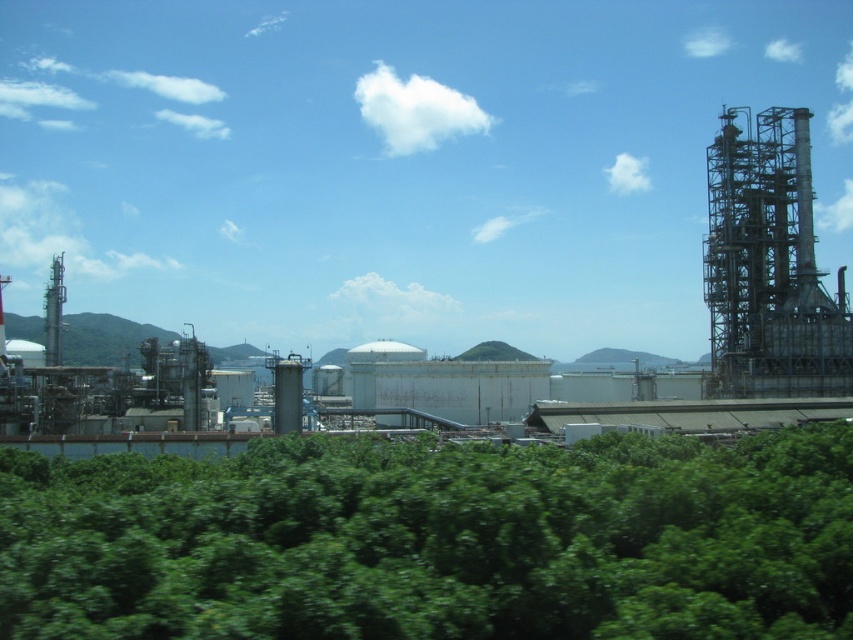
You are a drone operator tasked with capturing aerial footage of the industrial complex. You need to ensure that both the green leafy trees at lower center and the metallic gray structure at right are clearly visible in the shot. Considering their sizes, which object might require more careful framing to avoid being obscured by the other?

The metallic gray structure at right requires more careful framing since the green leafy trees at lower center are wider and could potentially block the view of the smaller metallic gray structure at right if not positioned correctly.